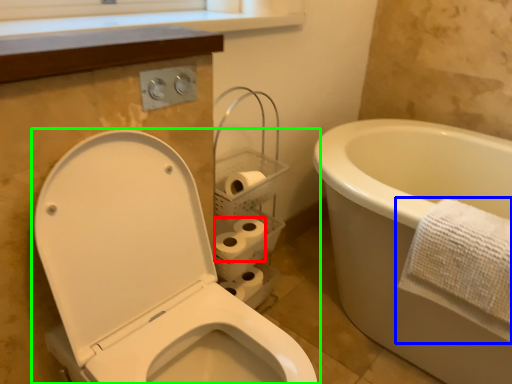
Question: Based on their relative distances, which object is nearer to toilet paper (highlighted by a red box)? Choose from towel (highlighted by a blue box) and toilet (highlighted by a green box).

Choices:
 (A) towel
 (B) toilet

Answer: (B)